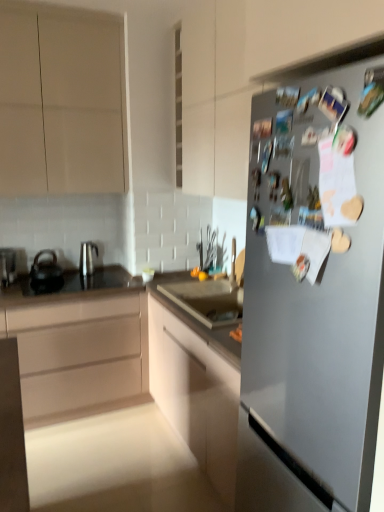
This screenshot has height=512, width=384. Find the location of `vacant space in front of black matte tea pot at left, acting as the 2th tea pot starting from the right`. vacant space in front of black matte tea pot at left, acting as the 2th tea pot starting from the right is located at coordinates (39, 286).